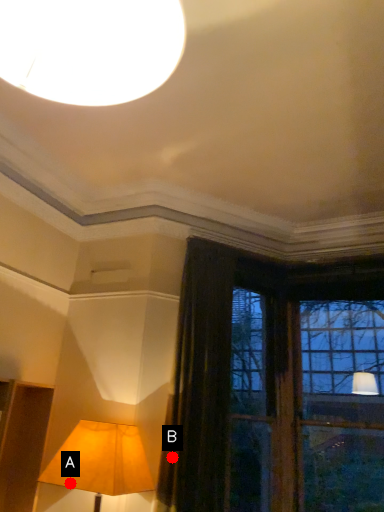
Question: Two points are circled on the image, labeled by A and B beside each circle. Among these points, which one is farthest from the camera?

Choices:
 (A) A is further
 (B) B is further

Answer: (B)